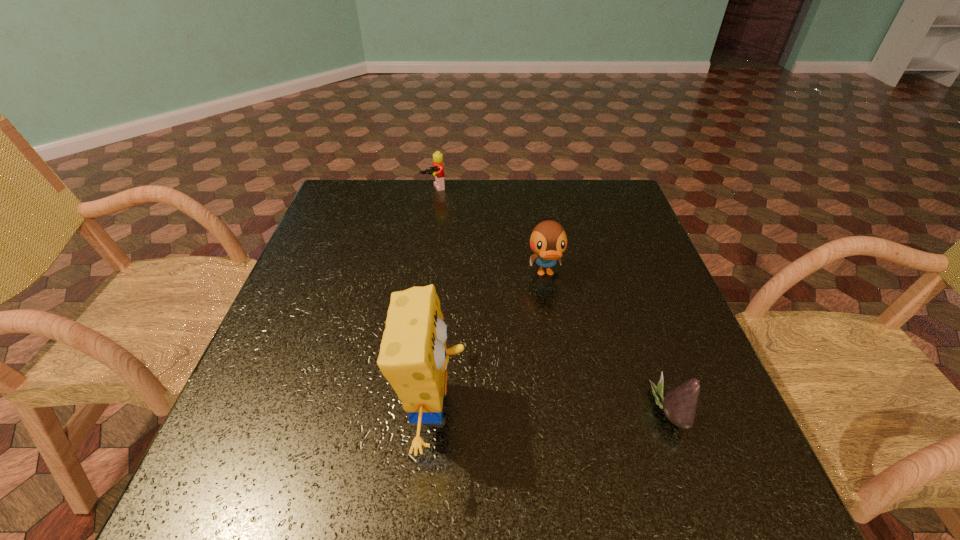
At what (x,y) coordinates should I click in order to perform the action: click on vacant space located in front of the farthest object with the accessory visible. Please return your answer as a coordinate pair (x, y). The image size is (960, 540). Looking at the image, I should click on (443, 205).

What are the coordinates of `vacant space positioned in front of the farthest object with the accessory visible` in the screenshot? It's located at (460, 235).

Find the location of a particular element. This screenshot has height=540, width=960. free space located in front of the farthest object with the accessory visible is located at coordinates (466, 246).

This screenshot has width=960, height=540. What are the coordinates of `object that is at the far edge` in the screenshot? It's located at (437, 171).

Where is `sponge present at the near edge`? This screenshot has width=960, height=540. sponge present at the near edge is located at coordinates (413, 357).

Find the location of a particular element. This screenshot has height=540, width=960. avocado at the near edge is located at coordinates (679, 404).

Locate an element on the screen. The height and width of the screenshot is (540, 960). object situated at the right edge is located at coordinates (679, 404).

Identify the location of object that is at the near right corner. pyautogui.click(x=679, y=404).

Where is `vacant region at the far edge`? This screenshot has height=540, width=960. vacant region at the far edge is located at coordinates (539, 179).

This screenshot has width=960, height=540. In order to click on free space at the near edge of the desktop in this screenshot , I will do `click(619, 434)`.